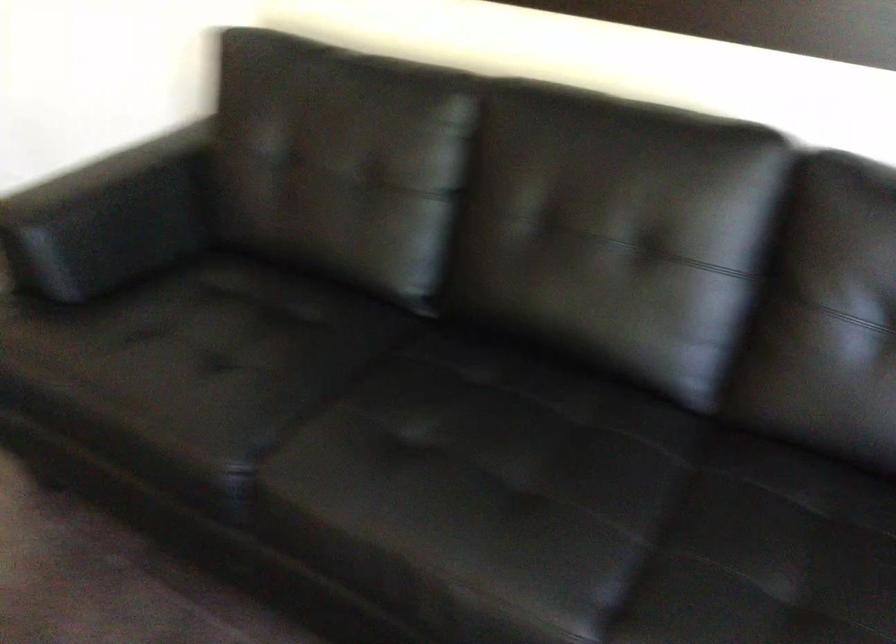
What do you see at coordinates (575, 511) in the screenshot?
I see `the black sofa sitting surface` at bounding box center [575, 511].